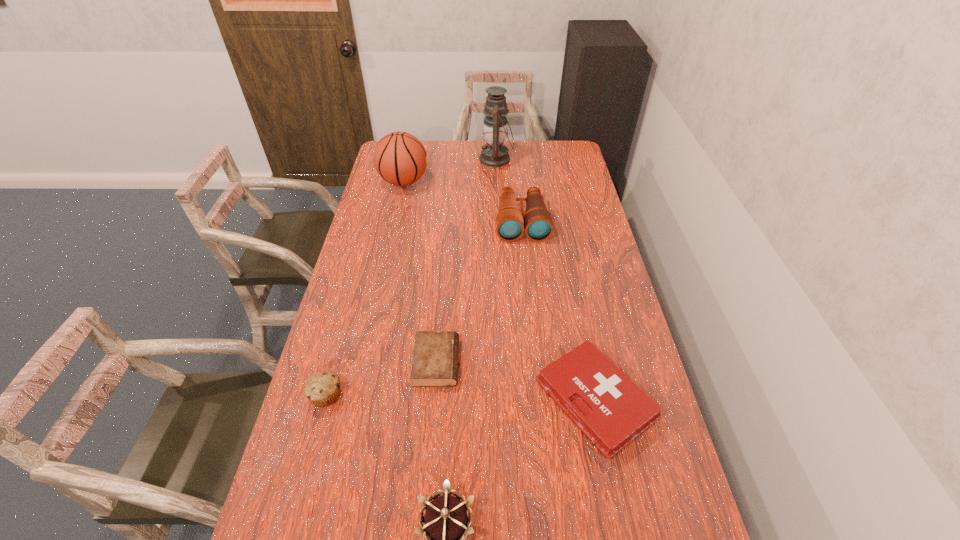
Where is `oil lamp`? oil lamp is located at coordinates (493, 154).

You are a GUI agent. You are given a task and a screenshot of the screen. Output one action in this format:
    pyautogui.click(x=<x>, y=<y>)
    Task: Click on the basketball
    The width and height of the screenshot is (960, 540).
    Given the screenshot: What is the action you would take?
    400,158

The width and height of the screenshot is (960, 540). What are the coordinates of `binoculars` in the screenshot? It's located at (x=510, y=222).

This screenshot has width=960, height=540. In order to click on the fifth shortest object in this screenshot , I will do `click(510, 222)`.

Locate an element on the screen. This screenshot has width=960, height=540. muffin is located at coordinates (323, 388).

Locate an element on the screen. The width and height of the screenshot is (960, 540). the second shortest object is located at coordinates (611, 410).

You are a GUI agent. You are given a task and a screenshot of the screen. Output one action in this format:
    pyautogui.click(x=<x>, y=<y>)
    Task: Click on the shortest object
    The height and width of the screenshot is (540, 960).
    Given the screenshot: What is the action you would take?
    pyautogui.click(x=435, y=357)

The image size is (960, 540). I want to click on vacant space located 0.130m on the left of the tallest object, so click(x=451, y=159).

Identify the location of free region located 0.250m on the side where the inflation valve is located. This screenshot has height=540, width=960. (486, 182).

You are a GUI agent. You are given a task and a screenshot of the screen. Output one action in this format:
    pyautogui.click(x=<x>, y=<y>)
    Task: Click on the free space located 0.060m through the lenses of the fifth nearest object
    
    Given the screenshot: What is the action you would take?
    pyautogui.click(x=525, y=253)